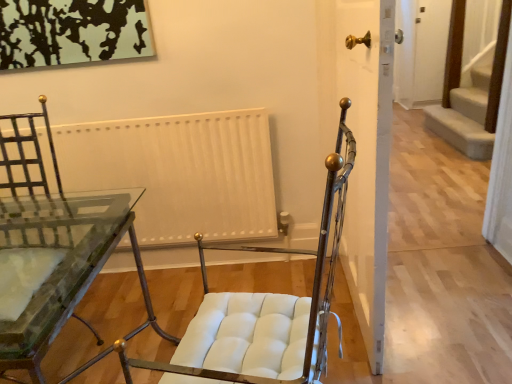
Question: Is white matte door at center taller or shorter than metallic/textured chair at center?

Choices:
 (A) short
 (B) tall

Answer: (B)

Question: From a real-world perspective, is white matte door at center physically located above or below metallic/textured chair at center?

Choices:
 (A) above
 (B) below

Answer: (A)

Question: Considering the real-world distances, which object is farthest from the white matte door at center?

Choices:
 (A) white matte radiator at center
 (B) metallic/textured chair at center
 (C) clear glass table at center

Answer: (C)

Question: Estimate the real-world distances between objects in this image. Which object is farther from the clear glass table at center?

Choices:
 (A) white matte door at center
 (B) white matte radiator at center
 (C) metallic/textured chair at center

Answer: (A)